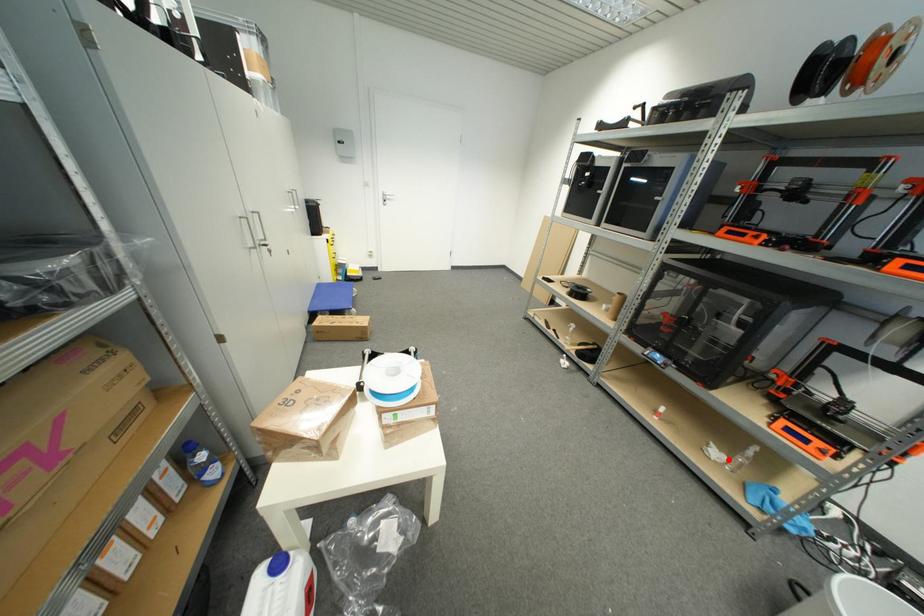
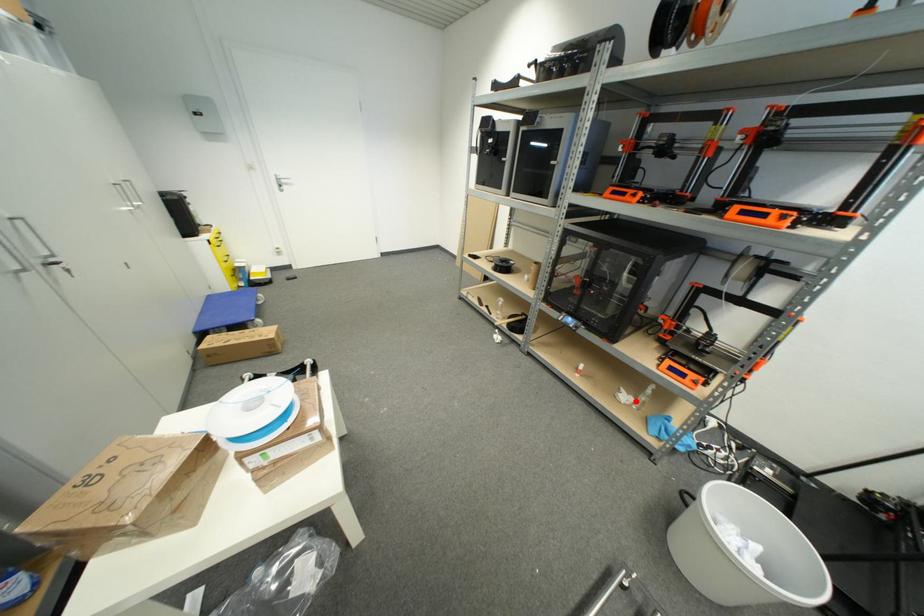
I am providing you with two images of the same scene from different viewpoints. A red point is marked on the first image and another point is marked on the second image. Are the points marked in image1 and image2 representing the same 3D position?

Yes